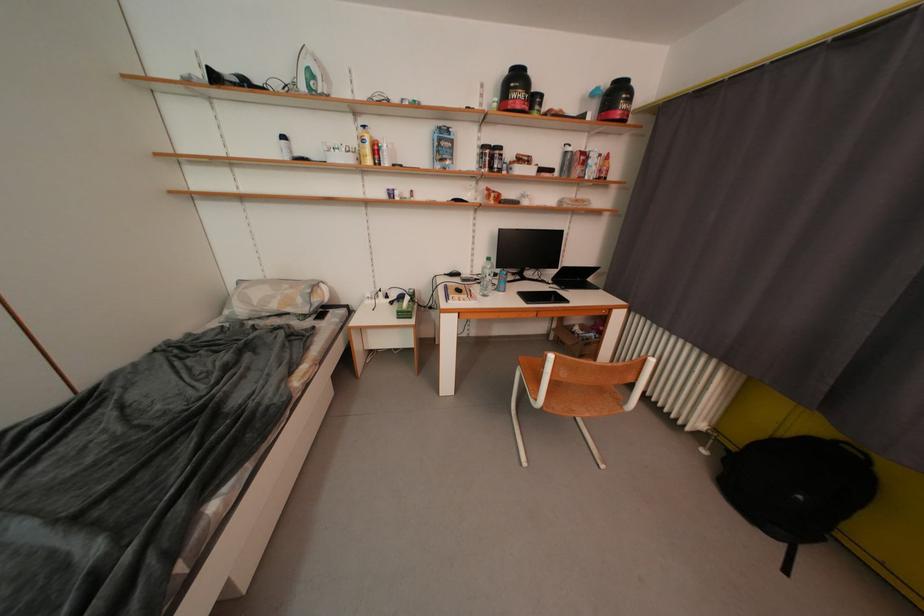
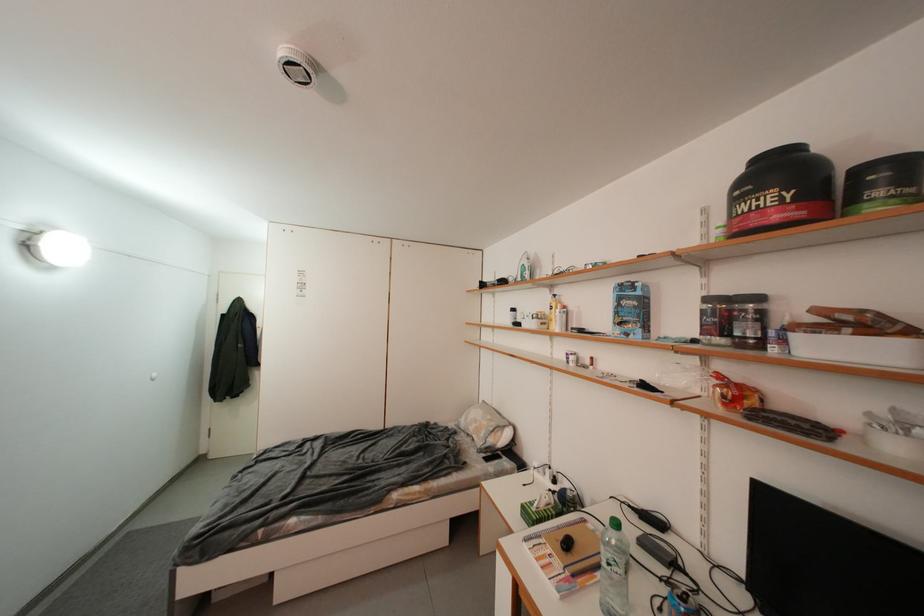
Find the pixel in the second image that matches the point at 447,143 in the first image.

(627, 302)